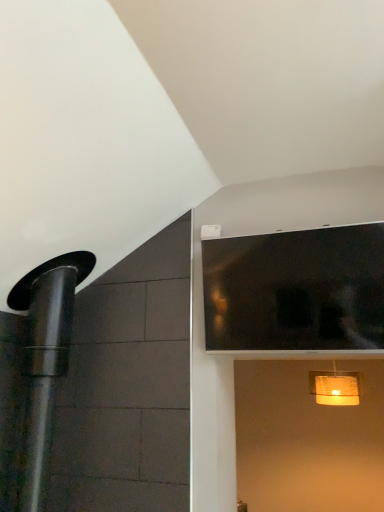
What do you see at coordinates (296, 290) in the screenshot? I see `black glass window at upper right` at bounding box center [296, 290].

Measure the distance between black glass window at upper right and camera.

A distance of 1.68 meters exists between black glass window at upper right and camera.

At what (x,y) coordinates should I click in order to perform the action: click on black glass window at upper right. Please return your answer as a coordinate pair (x, y). The width and height of the screenshot is (384, 512). Looking at the image, I should click on (296, 290).

Consider the image. Measure the distance between point [353,398] and camera.

The distance of point [353,398] from camera is 3.26 meters.

This screenshot has height=512, width=384. Describe the element at coordinates (335, 387) in the screenshot. I see `matte yellow lampshade at lower right` at that location.

Locate an element on the screen. matte yellow lampshade at lower right is located at coordinates (335, 387).

Where is `black glass window at upper right`? The height and width of the screenshot is (512, 384). black glass window at upper right is located at coordinates (296, 290).

In the scene shown: Is matte yellow lampshade at lower right to the right of black glass window at upper right from the viewer's perspective?

Indeed, matte yellow lampshade at lower right is positioned on the right side of black glass window at upper right.

Between matte yellow lampshade at lower right and black glass window at upper right, which one is positioned behind?

Positioned behind is matte yellow lampshade at lower right.

Does point (352, 398) lie behind point (330, 291)?

Yes, point (352, 398) is farther from viewer.

From the image's perspective, which one is positioned lower, matte yellow lampshade at lower right or black glass window at upper right?

matte yellow lampshade at lower right appears lower in the image.

From a real-world perspective, which object stands above the other?

black glass window at upper right is physically above.

Which object is thinner, matte yellow lampshade at lower right or black glass window at upper right?

black glass window at upper right is thinner.

From the picture: Who is taller, matte yellow lampshade at lower right or black glass window at upper right?

black glass window at upper right is taller.

Is matte yellow lampshade at lower right smaller than black glass window at upper right?

Correct, matte yellow lampshade at lower right occupies less space than black glass window at upper right.

Is matte yellow lampshade at lower right positioned beyond the bounds of black glass window at upper right?

matte yellow lampshade at lower right lies outside black glass window at upper right's area.

Is matte yellow lampshade at lower right next to black glass window at upper right?

No, matte yellow lampshade at lower right is not with black glass window at upper right.

Is matte yellow lampshade at lower right turned away from black glass window at upper right?

No, matte yellow lampshade at lower right is not facing away from black glass window at upper right.

From the picture: What's the angular difference between matte yellow lampshade at lower right and black glass window at upper right's facing directions?

The angular difference between matte yellow lampshade at lower right and black glass window at upper right is 12.7 degrees.

Measure the distance from matte yellow lampshade at lower right to black glass window at upper right.

A: matte yellow lampshade at lower right is 5.47 feet from black glass window at upper right.

Identify the location of window in front of the matte yellow lampshade at lower right. (296, 290).

Considering the positions of objects black glass window at upper right and matte yellow lampshade at lower right in the image provided, who is more to the left, black glass window at upper right or matte yellow lampshade at lower right?

Positioned to the left is black glass window at upper right.

Between black glass window at upper right and matte yellow lampshade at lower right, which one is positioned behind?

matte yellow lampshade at lower right is behind.

Is point (348, 335) positioned in front of point (355, 387)?

That is True.

From the image's perspective, is black glass window at upper right below matte yellow lampshade at lower right?

No.

From a real-world perspective, is black glass window at upper right below matte yellow lampshade at lower right?

No, from a real-world perspective, black glass window at upper right is not beneath matte yellow lampshade at lower right.

From the picture: Considering the sizes of black glass window at upper right and matte yellow lampshade at lower right in the image, is black glass window at upper right wider or thinner than matte yellow lampshade at lower right?

black glass window at upper right is thinner than matte yellow lampshade at lower right.

Is black glass window at upper right taller or shorter than matte yellow lampshade at lower right?

Considering their sizes, black glass window at upper right has more height than matte yellow lampshade at lower right.

Between black glass window at upper right and matte yellow lampshade at lower right, which one has smaller size?

matte yellow lampshade at lower right is smaller.

Would you say black glass window at upper right contains matte yellow lampshade at lower right?

No, matte yellow lampshade at lower right is located outside of black glass window at upper right.

Is the surface of black glass window at upper right in direct contact with matte yellow lampshade at lower right?

No.

Is black glass window at upper right positioned with its back to matte yellow lampshade at lower right?

Yes, black glass window at upper right is positioned with its back facing matte yellow lampshade at lower right.

How many degrees apart are the facing directions of black glass window at upper right and matte yellow lampshade at lower right?

black glass window at upper right and matte yellow lampshade at lower right are facing 12.7 degrees away from each other.

How distant is black glass window at upper right from matte yellow lampshade at lower right?

black glass window at upper right is 5.47 feet away from matte yellow lampshade at lower right.

Image resolution: width=384 pixels, height=512 pixels. I want to click on window that is on the left side of matte yellow lampshade at lower right, so click(x=296, y=290).

Where is `light fixture behind the black glass window at upper right`? light fixture behind the black glass window at upper right is located at coordinates (335, 387).

This screenshot has width=384, height=512. Identify the location of window above the matte yellow lampshade at lower right (from the image's perspective). (296, 290).